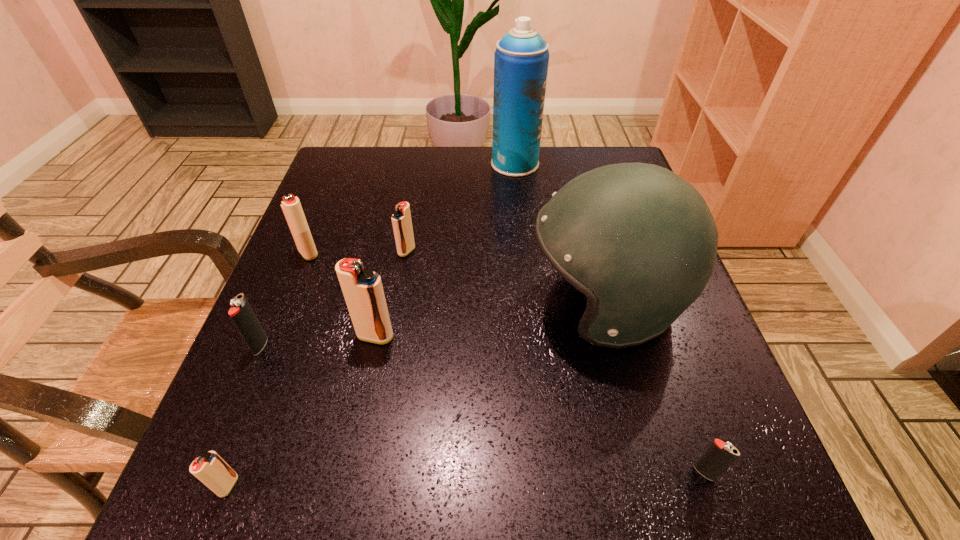
At what (x,y) coordinates should I click in order to perform the action: click on the second smallest red igniter. Please return your answer as a coordinate pair (x, y). The image size is (960, 540). Looking at the image, I should click on (401, 219).

Where is `the smallest red igniter`? This screenshot has height=540, width=960. the smallest red igniter is located at coordinates (210, 469).

The width and height of the screenshot is (960, 540). I want to click on the rightmost igniter, so click(x=719, y=455).

You are a GUI agent. You are given a task and a screenshot of the screen. Output one action in this format:
    pyautogui.click(x=<x>, y=<y>)
    Task: Click on the nearer black igniter
    Image resolution: width=960 pixels, height=540 pixels.
    Given the screenshot: What is the action you would take?
    pyautogui.click(x=719, y=455)

Locate an element on the screen. Image resolution: width=960 pixels, height=540 pixels. free spot located 0.110m on the front of the farthest object is located at coordinates coord(519,203).

Locate an element on the screen. free space located at the face opening of the second tallest object is located at coordinates (458, 303).

Where is `free space located at the face opening of the second tallest object`? free space located at the face opening of the second tallest object is located at coordinates (458, 303).

Identify the location of vacant space located at the face opening of the second tallest object. Image resolution: width=960 pixels, height=540 pixels. (500, 303).

Find the location of a particular element. The width and height of the screenshot is (960, 540). free region located 0.140m on the left of the second nearest red igniter is located at coordinates (278, 336).

Where is `vacant space located 0.100m on the front of the fourth tallest object`? The height and width of the screenshot is (540, 960). vacant space located 0.100m on the front of the fourth tallest object is located at coordinates (291, 297).